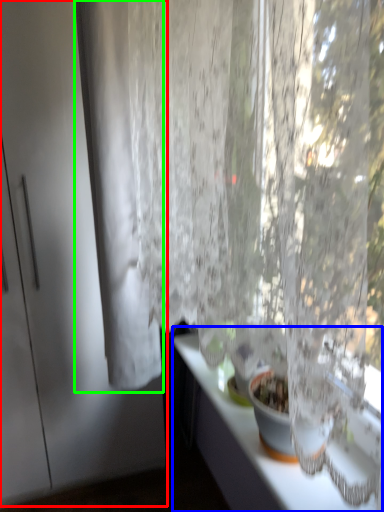
Question: Considering the real-world distances, which object is closest to screen door (highlighted by a red box)? counter top (highlighted by a blue box) or curtain (highlighted by a green box).

Choices:
 (A) counter top
 (B) curtain

Answer: (B)